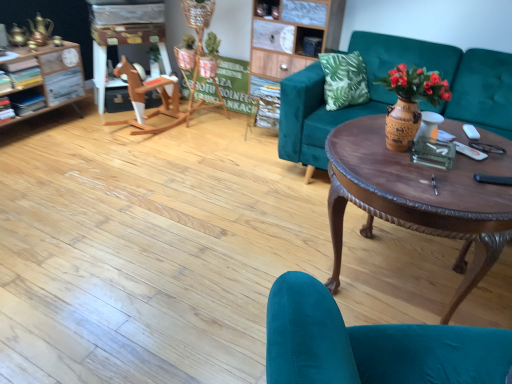
The height and width of the screenshot is (384, 512). What are the coordinates of `wooden vase with flowers at center` in the screenshot? It's located at (410, 102).

Image resolution: width=512 pixels, height=384 pixels. What do you see at coordinates (410, 102) in the screenshot? I see `wooden vase with flowers at center` at bounding box center [410, 102].

The height and width of the screenshot is (384, 512). What do you see at coordinates (394, 94) in the screenshot? I see `teal velvet couch at center` at bounding box center [394, 94].

Describe the element at coordinates (371, 344) in the screenshot. I see `teal velvet chair at lower right` at that location.

Measure the distance between green cardboard sign at center and camera.

green cardboard sign at center and camera are 3.51 meters apart.

Locate an element on the screen. Image resolution: width=512 pixels, height=384 pixels. wooden vase with flowers at center is located at coordinates (410, 102).

Are brown polished wood coffee table at center and teal velvet chair at lower right far apart?

They are positioned close to each other.

Does brown polished wood coffee table at center have a lesser height compared to teal velvet chair at lower right?

Correct, brown polished wood coffee table at center is not as tall as teal velvet chair at lower right.

From a real-world perspective, is brown polished wood coffee table at center positioned above or below teal velvet chair at lower right?

From a real-world perspective, brown polished wood coffee table at center is physically below teal velvet chair at lower right.

Does brown polished wood coffee table at center have a lesser width compared to teal velvet chair at lower right?

Incorrect, the width of brown polished wood coffee table at center is not less than that of teal velvet chair at lower right.

Is there a large distance between teal velvet chair at lower right and teal velvet couch at center?

teal velvet chair at lower right is far away from teal velvet couch at center.

Where is `studio couch lying above the teal velvet chair at lower right (from the image's perspective)`? The width and height of the screenshot is (512, 384). studio couch lying above the teal velvet chair at lower right (from the image's perspective) is located at coordinates (394, 94).

Could you tell me if teal velvet chair at lower right is facing teal velvet couch at center?

Yes.

Can you confirm if teal velvet chair at lower right is wider than wooden vase with flowers at center?

Yes.

Would you say teal velvet chair at lower right is outside wooden vase with flowers at center?

Absolutely, teal velvet chair at lower right is external to wooden vase with flowers at center.

From a real-world perspective, between teal velvet chair at lower right and wooden vase with flowers at center, who is vertically higher?

From a 3D spatial view, wooden vase with flowers at center is above.

Considering the positions of objects teal velvet chair at lower right and wooden vase with flowers at center in the image provided, who is more to the left, teal velvet chair at lower right or wooden vase with flowers at center?

teal velvet chair at lower right.

Is brown polished wood coffee table at center touching teal velvet couch at center?

No, brown polished wood coffee table at center is not with teal velvet couch at center.

From the image's perspective, which is below, brown polished wood coffee table at center or teal velvet couch at center?

brown polished wood coffee table at center, from the image's perspective.

Considering their positions, is brown polished wood coffee table at center located in front of or behind teal velvet couch at center?

brown polished wood coffee table at center is positioned closer to the viewer than teal velvet couch at center.

Is brown polished wood coffee table at center spatially inside teal velvet couch at center, or outside of it?

brown polished wood coffee table at center exists outside the volume of teal velvet couch at center.

Does wooden vase with flowers at center appear on the left side of teal velvet chair at lower right?

No, wooden vase with flowers at center is not to the left of teal velvet chair at lower right.

Could you tell me if wooden vase with flowers at center is turned towards teal velvet chair at lower right?

Yes, wooden vase with flowers at center is facing teal velvet chair at lower right.

Can you confirm if wooden vase with flowers at center is wider than teal velvet chair at lower right?

No, wooden vase with flowers at center is not wider than teal velvet chair at lower right.

Measure the distance from wooden vase with flowers at center to brown polished wood coffee table at center.

wooden vase with flowers at center and brown polished wood coffee table at center are 11.07 inches apart from each other.

Which object is thinner, wooden vase with flowers at center or brown polished wood coffee table at center?

wooden vase with flowers at center is thinner.

Does point (415, 77) come behind point (494, 136)?

No, it is in front of (494, 136).

Is green cardboard sign at center taller than brown polished wood coffee table at center?

No.

Can you see green cardboard sign at center touching brown polished wood coffee table at center?

No, green cardboard sign at center is not in contact with brown polished wood coffee table at center.

Which object is wider, green cardboard sign at center or brown polished wood coffee table at center?

Wider between the two is brown polished wood coffee table at center.

Does green cardboard sign at center appear on the right side of brown polished wood coffee table at center?

No.

I want to click on chair that is on the left side of brown polished wood coffee table at center, so click(x=371, y=344).

Where is `chair above the teal velvet couch at center (from a real-world perspective)`? chair above the teal velvet couch at center (from a real-world perspective) is located at coordinates (371, 344).

Looking at the image, which one is located further to brown polished wood coffee table at center, teal velvet couch at center or green cardboard sign at center?

green cardboard sign at center is further to brown polished wood coffee table at center.

Consider the image. When comparing their distances from green cardboard sign at center, does wooden rocking horse at left or wooden vase with flowers at center seem closer?

wooden rocking horse at left lies closer to green cardboard sign at center than the other object.

From the image, which object appears to be farther from wooden vase with flowers at center, green cardboard sign at center or teal velvet chair at lower right?

The object further to wooden vase with flowers at center is green cardboard sign at center.

When comparing their distances from wooden rocking horse at left, does green cardboard sign at center or teal velvet couch at center seem closer?

Among the two, green cardboard sign at center is located nearer to wooden rocking horse at left.

From the image, which object appears to be nearer to teal velvet chair at lower right, wooden vase with flowers at center or green cardboard sign at center?

wooden vase with flowers at center.

Looking at the image, which one is located further to teal velvet chair at lower right, green cardboard sign at center or wooden rocking horse at left?

green cardboard sign at center lies further to teal velvet chair at lower right than the other object.

In the scene shown: When comparing their distances from teal velvet couch at center, does teal velvet chair at lower right or brown polished wood coffee table at center seem closer?

brown polished wood coffee table at center is closer to teal velvet couch at center.

Estimate the real-world distances between objects in this image. Which object is further from brown polished wood coffee table at center, green cardboard sign at center or teal velvet couch at center?

green cardboard sign at center lies further to brown polished wood coffee table at center than the other object.

Find the location of a particular element. wide between brown polished wood coffee table at center and green cardboard sign at center along the z-axis is located at coordinates (144, 100).

Where is `studio couch between teal velvet chair at lower right and green cardboard sign at center along the z-axis`? studio couch between teal velvet chair at lower right and green cardboard sign at center along the z-axis is located at coordinates (394, 94).

You are a GUI agent. You are given a task and a screenshot of the screen. Output one action in this format:
    pyautogui.click(x=<x>, y=<y>)
    Task: Click on the floral arrangement between teal velvet chair at lower right and wooden rocking horse at left along the z-axis
    
    Given the screenshot: What is the action you would take?
    pyautogui.click(x=410, y=102)

I want to click on coffee table between teal velvet chair at lower right and green cardboard sign at center along the z-axis, so click(x=419, y=198).